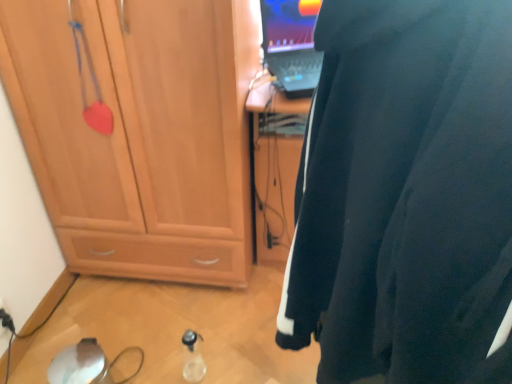
Question: From the image's perspective, is matte wood cabinet at left located beneath black fabric wetsuit at right?

Choices:
 (A) yes
 (B) no

Answer: (B)

Question: Is matte wood cabinet at left not inside black fabric wetsuit at right?

Choices:
 (A) yes
 (B) no

Answer: (A)

Question: Is matte wood cabinet at left taller than black fabric wetsuit at right?

Choices:
 (A) no
 (B) yes

Answer: (A)

Question: Is matte wood cabinet at left behind black fabric wetsuit at right?

Choices:
 (A) no
 (B) yes

Answer: (B)

Question: Is black fabric wetsuit at right completely or partially inside matte wood cabinet at left?

Choices:
 (A) yes
 (B) no

Answer: (B)

Question: From the image's perspective, is black fabric wetsuit at right positioned above or below matte wood cabinet at left?

Choices:
 (A) above
 (B) below

Answer: (B)

Question: From a real-world perspective, is black fabric wetsuit at right positioned above or below matte wood cabinet at left?

Choices:
 (A) below
 (B) above

Answer: (B)

Question: Looking at the image, does black fabric wetsuit at right seem bigger or smaller compared to matte wood cabinet at left?

Choices:
 (A) big
 (B) small

Answer: (A)

Question: Does point (296, 236) appear closer or farther from the camera than point (159, 203)?

Choices:
 (A) farther
 (B) closer

Answer: (B)

Question: From the image's perspective, is matte wood cabinet at left positioned above or below transparent plastic bottle at lower center?

Choices:
 (A) below
 (B) above

Answer: (B)

Question: Which is correct: matte wood cabinet at left is inside transparent plastic bottle at lower center, or outside of it?

Choices:
 (A) outside
 (B) inside

Answer: (A)

Question: Considering their positions, is matte wood cabinet at left located in front of or behind transparent plastic bottle at lower center?

Choices:
 (A) front
 (B) behind

Answer: (A)

Question: Is point (87, 192) closer or farther from the camera than point (196, 339)?

Choices:
 (A) farther
 (B) closer

Answer: (A)

Question: From their relative heights in the image, would you say transparent plastic bottle at lower center is taller or shorter than black plastic electric outlet at lower left?

Choices:
 (A) tall
 (B) short

Answer: (A)

Question: From a real-world perspective, relative to black plastic electric outlet at lower left, is transparent plastic bottle at lower center vertically above or below?

Choices:
 (A) below
 (B) above

Answer: (A)